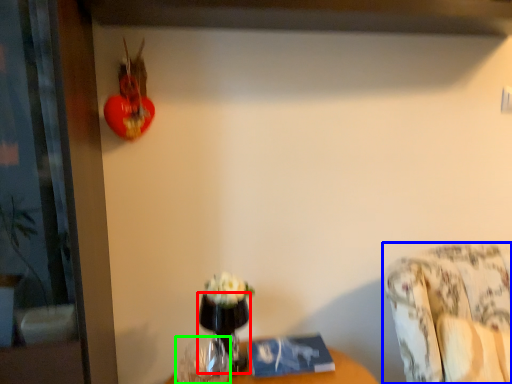
Question: Considering the real-world distances, which object is closest to glass vase (highlighted by a red box)? furniture (highlighted by a blue box) or vase (highlighted by a green box).

Choices:
 (A) furniture
 (B) vase

Answer: (B)